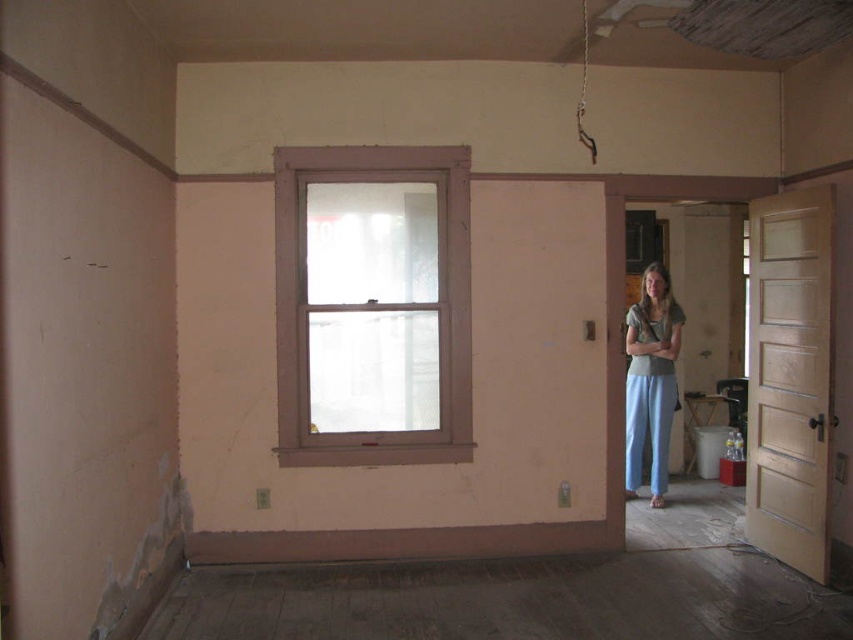
Question: Which of the following is the closest to the observer?

Choices:
 (A) (660, 317)
 (B) (361, 406)

Answer: (B)

Question: Is white painted wood window at center wider than light blue cotton pants at right?

Choices:
 (A) yes
 (B) no

Answer: (A)

Question: From the image, what is the correct spatial relationship of white painted wood window at center in relation to light blue cotton pants at right?

Choices:
 (A) right
 (B) left

Answer: (B)

Question: Among these objects, which one is farthest from the camera?

Choices:
 (A) light blue cotton pants at right
 (B) white painted wood window at center

Answer: (A)

Question: Observing the image, what is the correct spatial positioning of white painted wood window at center in reference to light blue cotton pants at right?

Choices:
 (A) below
 (B) above

Answer: (B)